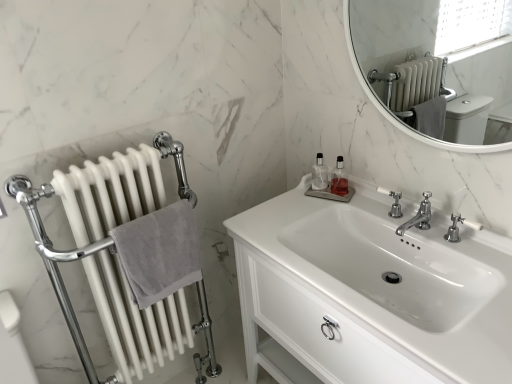
Find the location of a particular element. vacant space that is to the left of polished chrome faucet at right, the second tap when ordered from left to right is located at coordinates (x=420, y=240).